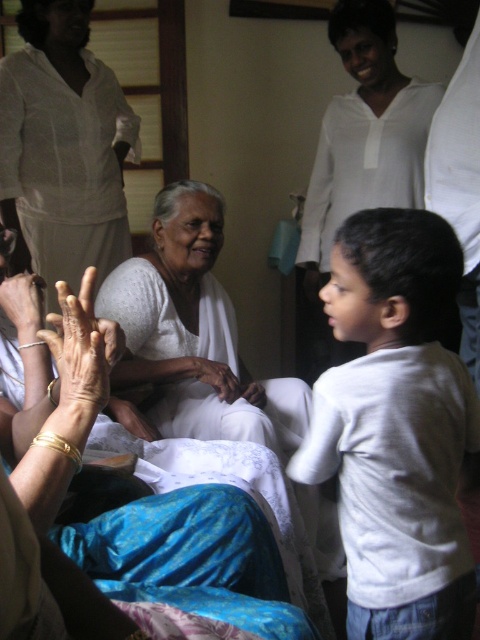
Is white fabric at center thinner than white cloth at center?

No, white fabric at center is not thinner than white cloth at center.

Identify the location of white fabric at center. (146, 497).

Does white cloth at center appear on the left side of smooth white hand at center?

Indeed, white cloth at center is positioned on the left side of smooth white hand at center.

Which of these two, white cloth at center or smooth white hand at center, stands taller?

With more height is white cloth at center.

Identify the location of white cloth at center. The width and height of the screenshot is (480, 640). (62, 148).

The image size is (480, 640). I want to click on white cloth at center, so click(x=62, y=148).

Find the location of a particular element. This screenshot has height=640, width=480. white cloth at center is located at coordinates (62, 148).

Between white cloth at center and dry skin hand at lower left, which one is positioned higher?

white cloth at center

The height and width of the screenshot is (640, 480). Describe the element at coordinates (62, 148) in the screenshot. I see `white cloth at center` at that location.

Where is `white cloth at center`? white cloth at center is located at coordinates (62, 148).